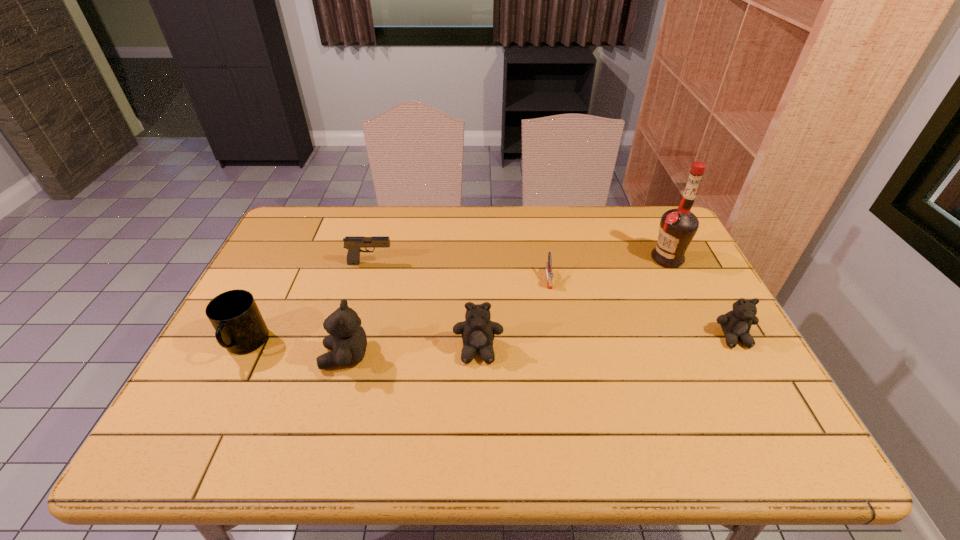
I want to click on the leftmost teddy bear, so click(347, 341).

Where is `the second teddy bear from right to left`? the second teddy bear from right to left is located at coordinates (477, 331).

You are a GUI agent. You are given a task and a screenshot of the screen. Output one action in this format:
    pyautogui.click(x=<x>, y=<y>)
    Task: Click on the second tallest teddy bear
    The image size is (960, 540).
    Given the screenshot: What is the action you would take?
    pyautogui.click(x=477, y=331)

I want to click on the shortest teddy bear, so point(736,324).

Image resolution: width=960 pixels, height=540 pixels. In order to click on pistol in this screenshot , I will do `click(353, 244)`.

The width and height of the screenshot is (960, 540). Identify the location of the shortest object. pos(548,268).

At what (x,y) coordinates should I click in order to perform the action: click on stapler. Please return your answer as a coordinate pair (x, y). The height and width of the screenshot is (540, 960). Looking at the image, I should click on click(548, 268).

The image size is (960, 540). I want to click on the tallest object, so click(677, 228).

At what (x,y) coordinates should I click in order to perform the action: click on the leftmost object. Please return your answer as a coordinate pair (x, y). The height and width of the screenshot is (540, 960). Looking at the image, I should click on (239, 327).

At what (x,y) coordinates should I click in order to perform the action: click on vacant region located 0.180m on the face of the leftmost teddy bear. Please return your answer as a coordinate pair (x, y). Looking at the image, I should click on click(x=249, y=357).